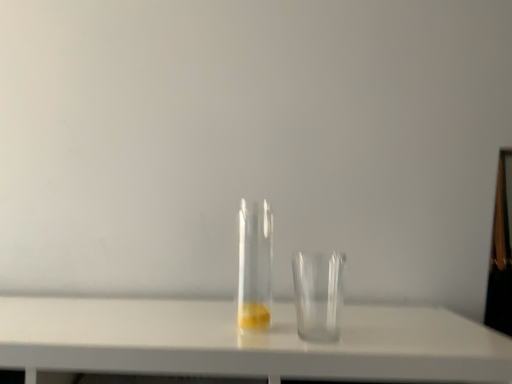
What do you see at coordinates (255, 265) in the screenshot? I see `transparent glass tube at center` at bounding box center [255, 265].

You are a GUI agent. You are given a task and a screenshot of the screen. Output one action in this format:
    pyautogui.click(x=<x>, y=<y>)
    Task: Click on the transparent glass tube at center
    
    Given the screenshot: What is the action you would take?
    pyautogui.click(x=255, y=265)

Where is `transparent glass cup at center`? This screenshot has height=384, width=512. transparent glass cup at center is located at coordinates (318, 295).

What do you see at coordinates (318, 295) in the screenshot? This screenshot has height=384, width=512. I see `transparent glass cup at center` at bounding box center [318, 295].

In order to click on transparent glass tube at center in this screenshot , I will do `click(255, 265)`.

Considering the positions of objects transparent glass cup at center and transparent glass tube at center in the image provided, who is more to the left, transparent glass cup at center or transparent glass tube at center?

transparent glass tube at center is more to the left.

Is transparent glass cup at center positioned in front of transparent glass tube at center?

Yes, it is in front of transparent glass tube at center.

Which point is more distant from viewer, (341, 288) or (257, 311)?

Point (341, 288)

From the image's perspective, relative to transparent glass tube at center, is transparent glass cup at center above or below?

Clearly, from the image's perspective, transparent glass cup at center is below transparent glass tube at center.

From a real-world perspective, is transparent glass cup at center positioned under transparent glass tube at center based on gravity?

Yes, from a real-world perspective, transparent glass cup at center is beneath transparent glass tube at center.

Can you confirm if transparent glass cup at center is thinner than transparent glass tube at center?

Incorrect, the width of transparent glass cup at center is not less than that of transparent glass tube at center.

Considering the sizes of transparent glass cup at center and transparent glass tube at center in the image, is transparent glass cup at center taller or shorter than transparent glass tube at center?

transparent glass cup at center is shorter than transparent glass tube at center.

Is transparent glass cup at center bigger or smaller than transparent glass tube at center?

transparent glass cup at center is smaller than transparent glass tube at center.

Is transparent glass tube at center surrounded by transparent glass cup at center?

No, transparent glass tube at center is not a part of transparent glass cup at center.

Can you see transparent glass cup at center touching transparent glass tube at center?

Yes, transparent glass cup at center is right next to transparent glass tube at center and making contact.

Consider the image. Is transparent glass cup at center turned away from transparent glass tube at center?

That's not correct — transparent glass cup at center is not looking away from transparent glass tube at center.

At what (x,y) coordinates should I click in order to perform the action: click on bottle that appears on the left of transparent glass cup at center. Please return your answer as a coordinate pair (x, y). Looking at the image, I should click on (255, 265).

Is transparent glass tube at center at the left side of transparent glass cup at center?

Yes, transparent glass tube at center is to the left of transparent glass cup at center.

Which object is closer to the camera, transparent glass tube at center or transparent glass cup at center?

transparent glass cup at center is in front.

Is point (260, 328) closer to camera compared to point (309, 283)?

Yes, it is.

From the image's perspective, which is below, transparent glass tube at center or transparent glass cup at center?

From the image's view, transparent glass cup at center is below.

From a real-world perspective, which is physically above, transparent glass tube at center or transparent glass cup at center?

transparent glass tube at center is physically above.

Can you confirm if transparent glass tube at center is thinner than transparent glass cup at center?

Correct, the width of transparent glass tube at center is less than that of transparent glass cup at center.

In the scene shown: Is transparent glass tube at center taller or shorter than transparent glass cup at center?

Considering their sizes, transparent glass tube at center has more height than transparent glass cup at center.

In terms of size, does transparent glass tube at center appear bigger or smaller than transparent glass cup at center?

Considering their sizes, transparent glass tube at center takes up more space than transparent glass cup at center.

Is transparent glass cup at center located within transparent glass tube at center?

No, transparent glass tube at center does not contain transparent glass cup at center.

Is transparent glass tube at center positioned far away from transparent glass cup at center?

No, there isn't a large distance between transparent glass tube at center and transparent glass cup at center.

Is transparent glass tube at center oriented towards transparent glass cup at center?

No.

The height and width of the screenshot is (384, 512). Find the location of `bottle above the transparent glass cup at center (from the image's perspective)`. bottle above the transparent glass cup at center (from the image's perspective) is located at coordinates (255, 265).

Locate an element on the screen. tableware in front of the transparent glass tube at center is located at coordinates (318, 295).

Locate an element on the screen. The width and height of the screenshot is (512, 384). tableware below the transparent glass tube at center (from the image's perspective) is located at coordinates (318, 295).